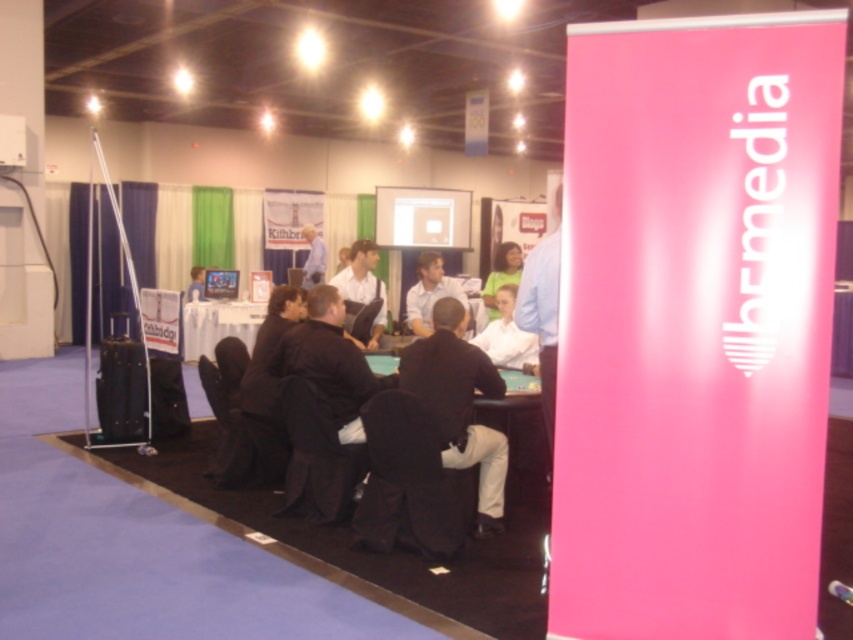
You are observing a group of people at a conference booth. There are two individuals wearing a matte black shirt at center and a light blue shirt at center. Which shirt is closer to you?

The matte black shirt at center is closer to you because it is in front of the light blue shirt at center.

You are organizing an event and need to place both a wooden table at center and a smooth black table at center in a small room. Which table should you choose to minimize the space they take up?

The wooden table at center occupies less space than the smooth black table at center, so you should choose the wooden table at center to minimize the space they take up.